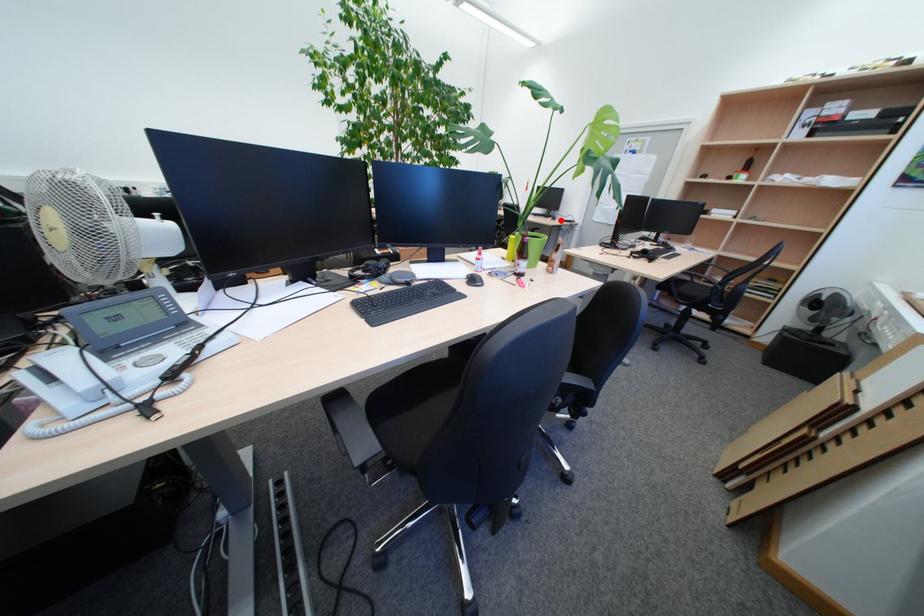
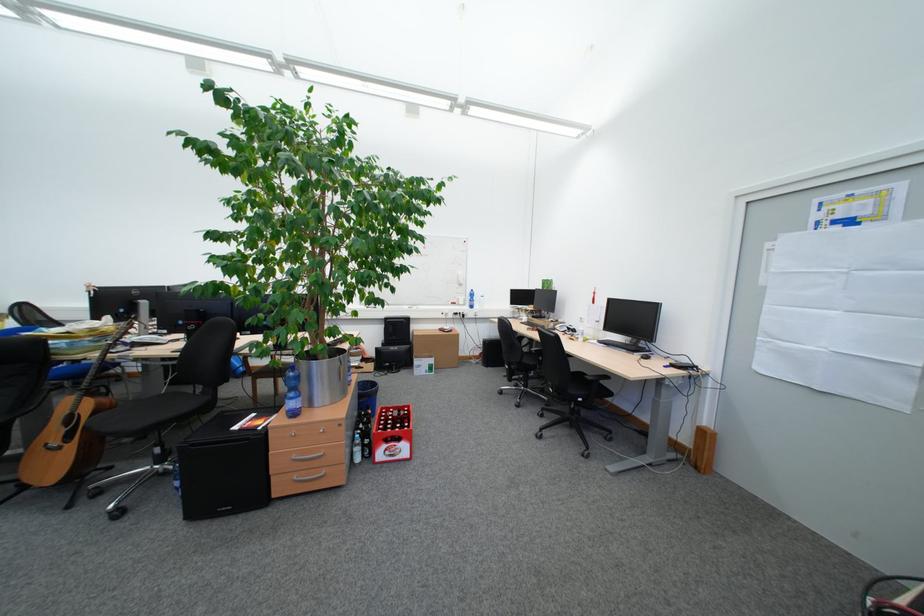
Where in the second image is the point corresponding to the highlighted location from the first image?

(648, 357)